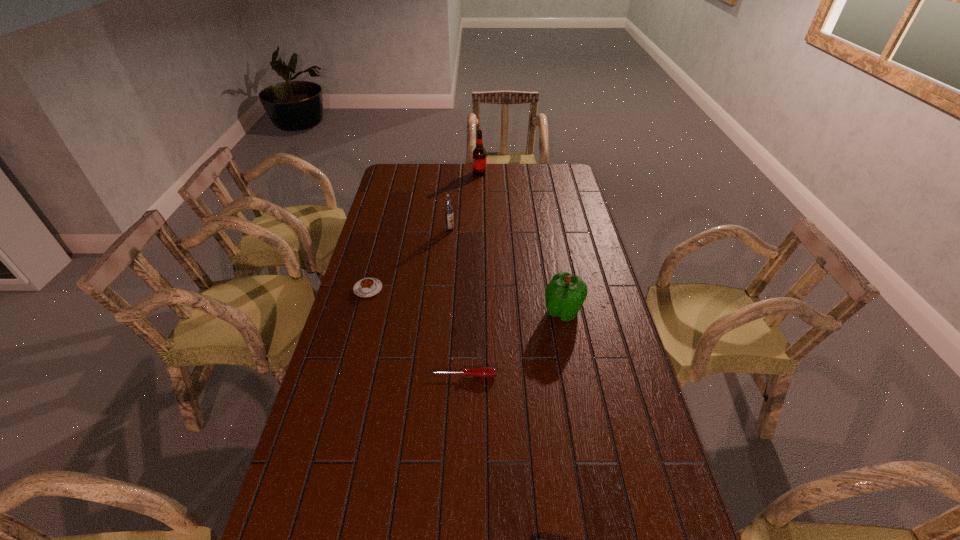
This screenshot has width=960, height=540. What are the coordinates of `the tallest object` in the screenshot? It's located at (479, 153).

Where is `the farthest object`? The width and height of the screenshot is (960, 540). the farthest object is located at coordinates [479, 153].

Find the location of a particular element. the second farthest object is located at coordinates (x=448, y=209).

Locate an element on the screen. The height and width of the screenshot is (540, 960). bell pepper is located at coordinates (565, 294).

The height and width of the screenshot is (540, 960). Find the location of `pudding`. pudding is located at coordinates (367, 287).

Identify the location of the fourth tallest object. Image resolution: width=960 pixels, height=540 pixels. (367, 287).

Locate an element on the screen. The image size is (960, 540). the second shortest object is located at coordinates (486, 372).

Locate an element on the screen. the taller screwdriver is located at coordinates (486, 372).

Locate an element on the screen. Image resolution: width=960 pixels, height=540 pixels. free space located on the left of the root beer is located at coordinates tap(429, 173).

Image resolution: width=960 pixels, height=540 pixels. What are the coordinates of `free space located 0.060m on the label of the vodka` in the screenshot? It's located at (448, 241).